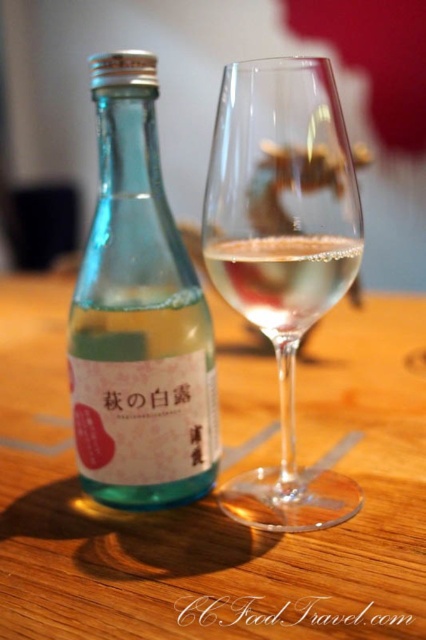
You are holding a small toy car that is 10 centimeters long. You want to place it on the table next to the transparent glass bottle at left. Is there enough space between you and the bottle to fit the toy car?

The transparent glass bottle at left is 25.71 centimeters away from the viewer. Since the toy car is only 10 centimeters long, there is sufficient space between you and the bottle to place the toy car.

You are holding a small toy that is 3 inches wide. You want to place it on the table near the clear glass wine glass at center. Can you fit it there without touching the glass?

The distance between the clear glass wine glass at center and the viewer is 9.14 inches. Since the toy is only 3 inches wide, there is enough space to place it on the table near the glass without touching it.

You are standing in front of a wooden table with a bottle and a glass. The bottle is at the left. What is the 2D coordinate of the transparent glass bottle at left?

The 2D coordinate of the transparent glass bottle at left is at point (x=138, y=317).